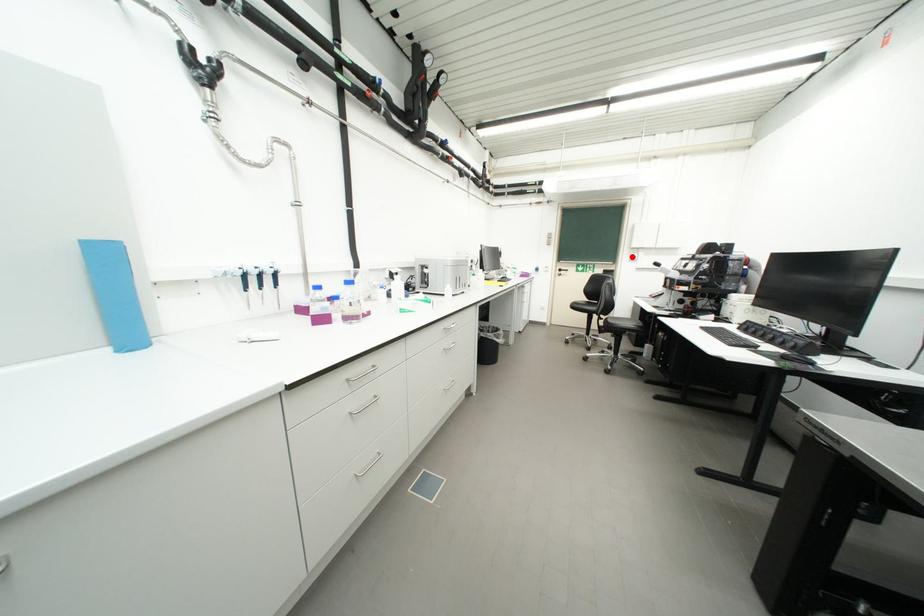
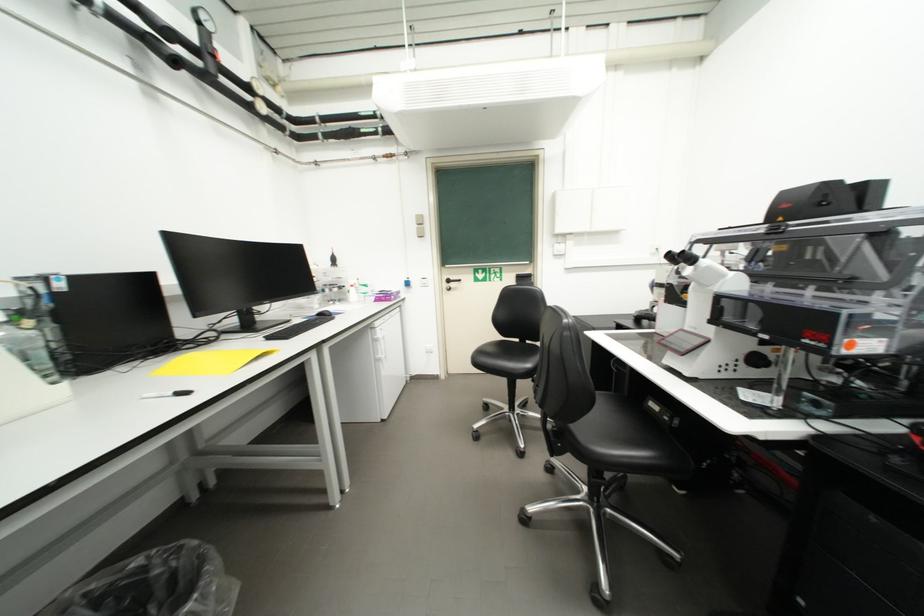
Find the pixel in the second image that matches the highlighted location in the first image.

(553, 249)